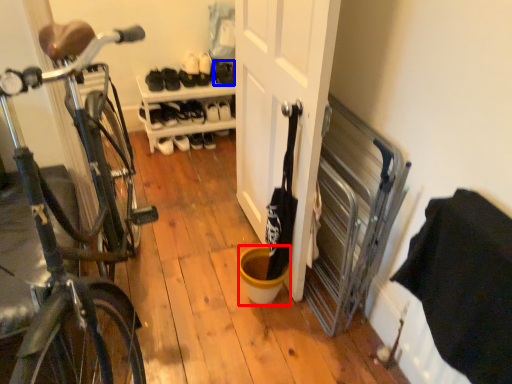
Question: Which object appears farthest to the camera in this image, bucket (highlighted by a red box) or shoe (highlighted by a blue box)?

Choices:
 (A) bucket
 (B) shoe

Answer: (B)